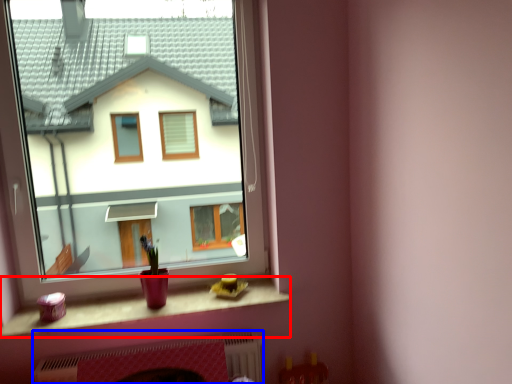
Question: Among these objects, which one is farthest to the camera, window sill (highlighted by a red box) or fireplace (highlighted by a blue box)?

Choices:
 (A) window sill
 (B) fireplace

Answer: (B)